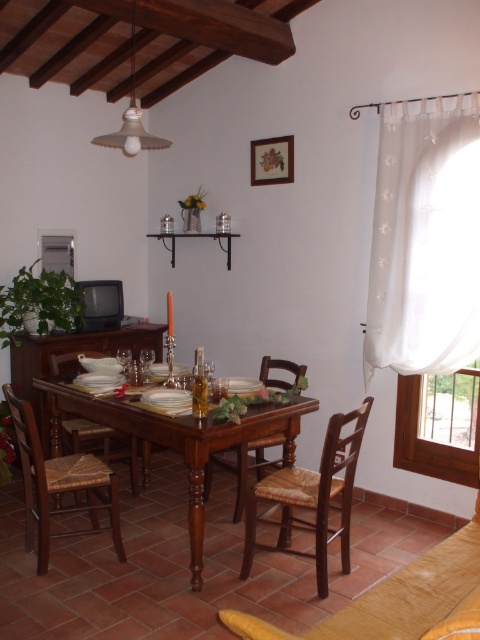
Does woven wood chair at lower left appear under woven wood chair at center?

Actually, woven wood chair at lower left is above woven wood chair at center.

Identify the location of woven wood chair at lower left. The width and height of the screenshot is (480, 640). (59, 484).

Can you confirm if brown woven chair at center is shorter than woven wood chair at lower left?

Yes.

Is brown woven chair at center positioned behind woven wood chair at lower left?

No, it is in front of woven wood chair at lower left.

This screenshot has width=480, height=640. Describe the element at coordinates (311, 497) in the screenshot. I see `brown woven chair at center` at that location.

At what (x,y) coordinates should I click in order to perform the action: click on brown woven chair at center. Please return your answer as a coordinate pair (x, y). The height and width of the screenshot is (640, 480). Looking at the image, I should click on (311, 497).

Is white sheer curtain at right closer to the viewer compared to woven wood chair at lower left?

No.

Which is below, white sheer curtain at right or woven wood chair at lower left?

Positioned lower is woven wood chair at lower left.

This screenshot has width=480, height=640. What are the coordinates of `white sheer curtain at right` in the screenshot? It's located at (424, 237).